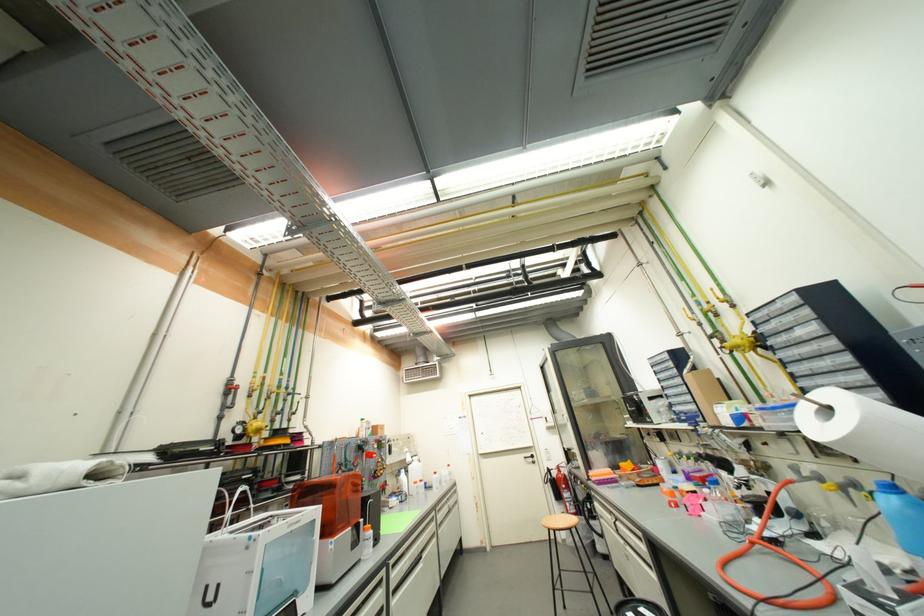
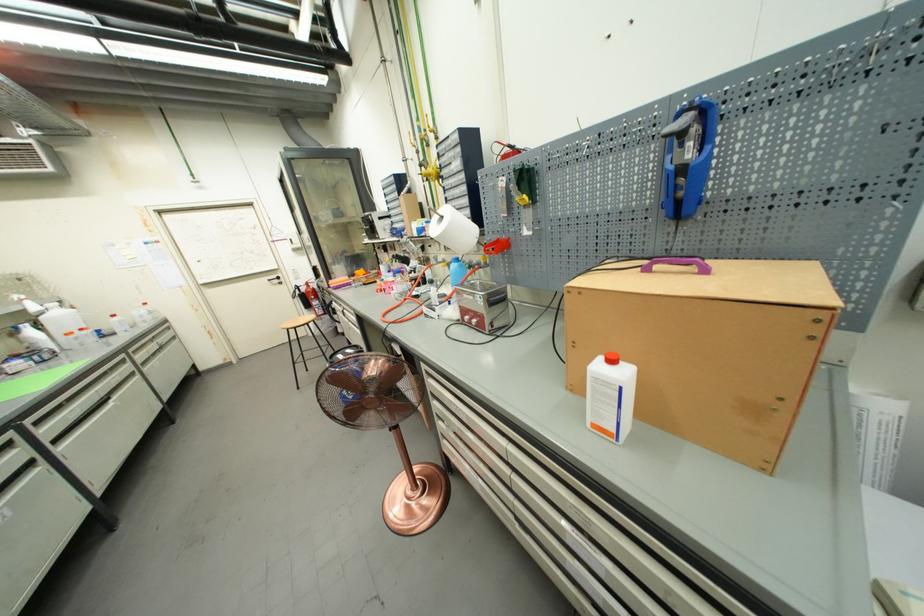
The point at (x=681, y=371) is marked in the first image. Where is the corresponding point in the second image?

(402, 196)